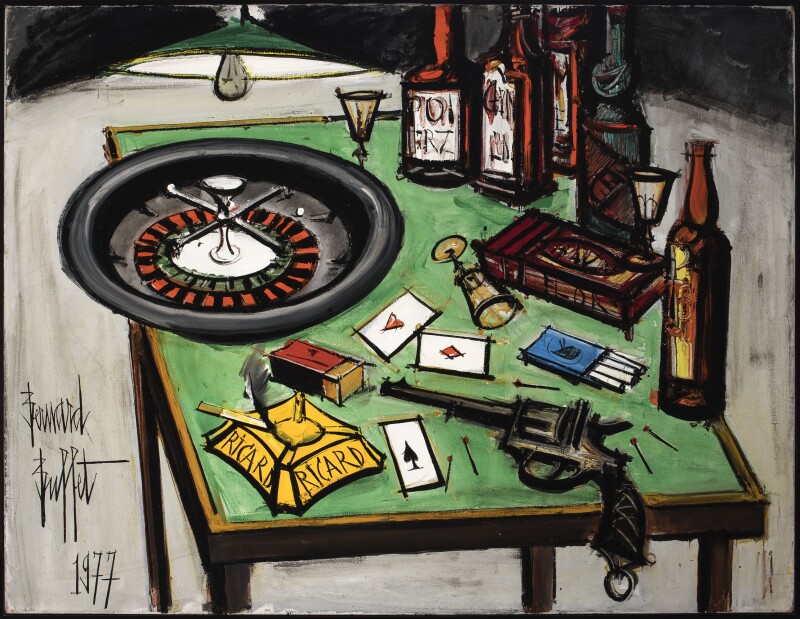
Find the location of a particular element. Image resolution: width=800 pixels, height=619 pixels. ash tray is located at coordinates [x=298, y=449].